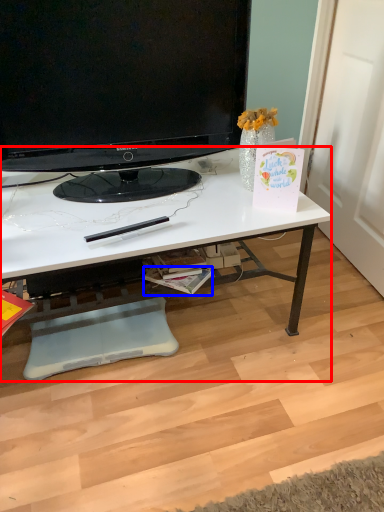
Question: Which object is further to the camera taking this photo, desk (highlighted by a red box) or magazine (highlighted by a blue box)?

Choices:
 (A) desk
 (B) magazine

Answer: (B)